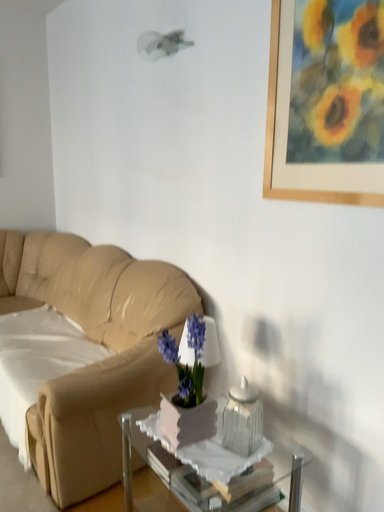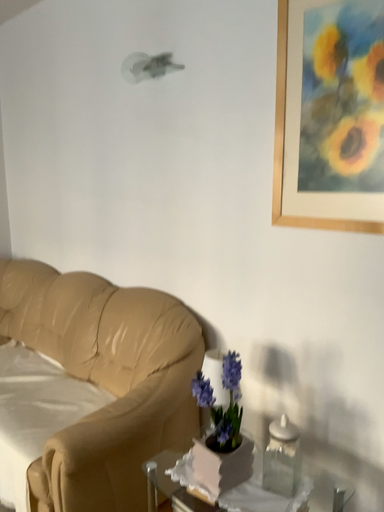
Question: How did the camera likely rotate when shooting the video?

Choices:
 (A) rotated right
 (B) rotated left

Answer: (A)